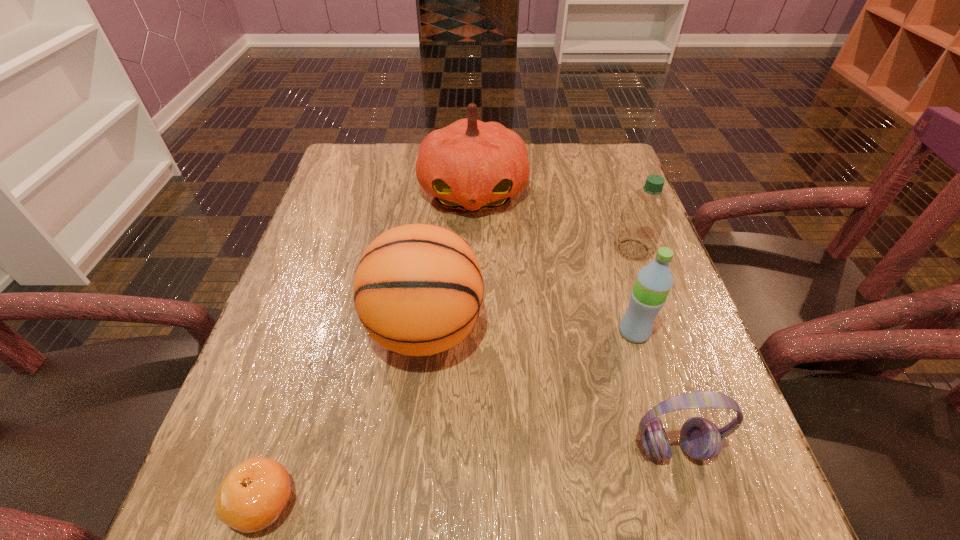
This screenshot has height=540, width=960. Find the location of `free space at the left edge`. free space at the left edge is located at coordinates (298, 260).

Identify the location of blank area at the right edge. This screenshot has height=540, width=960. (605, 232).

What are the coordinates of `vacant space at the far left corner of the desktop` in the screenshot? It's located at (348, 148).

The image size is (960, 540). I want to click on free space at the far right corner, so click(563, 145).

Where is `free region at the near right corner of the desktop`? free region at the near right corner of the desktop is located at coordinates (713, 485).

Image resolution: width=960 pixels, height=540 pixels. I want to click on vacant area that lies between the farther water bottle and the farthest object, so click(x=553, y=221).

This screenshot has height=540, width=960. I want to click on vacant area that lies between the farthest object and the clementine, so click(368, 348).

The image size is (960, 540). Find the location of `free space between the nearest object and the farthest object`. free space between the nearest object and the farthest object is located at coordinates (368, 348).

What are the coordinates of `free area in between the second shortest object and the farther water bottle` in the screenshot? It's located at (653, 348).

Image resolution: width=960 pixels, height=540 pixels. Find the location of `vacant space in between the shortest object and the farthest object`. vacant space in between the shortest object and the farthest object is located at coordinates (368, 348).